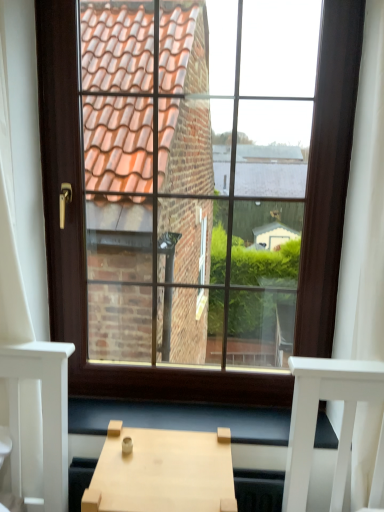
Question: From a real-world perspective, is brown wooden window at center below light wood table at center?

Choices:
 (A) yes
 (B) no

Answer: (B)

Question: Is the depth of brown wooden window at center less than that of light wood table at center?

Choices:
 (A) yes
 (B) no

Answer: (B)

Question: Is brown wooden window at center in contact with light wood table at center?

Choices:
 (A) yes
 (B) no

Answer: (B)

Question: From the image's perspective, is brown wooden window at center located above light wood table at center?

Choices:
 (A) no
 (B) yes

Answer: (B)

Question: Is brown wooden window at center thinner than light wood table at center?

Choices:
 (A) no
 (B) yes

Answer: (B)

Question: From their relative heights in the image, would you say brown wooden window at center is taller or shorter than light wood table at center?

Choices:
 (A) short
 (B) tall

Answer: (B)

Question: Considering the positions of brown wooden window at center and light wood table at center in the image, is brown wooden window at center wider or thinner than light wood table at center?

Choices:
 (A) wide
 (B) thin

Answer: (B)

Question: Is brown wooden window at center in front of or behind light wood table at center in the image?

Choices:
 (A) behind
 (B) front

Answer: (A)

Question: Does point (140, 384) appear closer or farther from the camera than point (107, 448)?

Choices:
 (A) closer
 (B) farther

Answer: (B)

Question: From a real-world perspective, is wooden at lower center positioned above or below brown wooden window at center?

Choices:
 (A) above
 (B) below

Answer: (B)

Question: Which is correct: wooden at lower center is inside brown wooden window at center, or outside of it?

Choices:
 (A) inside
 (B) outside

Answer: (B)

Question: Is wooden at lower center taller or shorter than brown wooden window at center?

Choices:
 (A) short
 (B) tall

Answer: (A)

Question: Considering the positions of wooden at lower center and brown wooden window at center in the image, is wooden at lower center wider or thinner than brown wooden window at center?

Choices:
 (A) thin
 (B) wide

Answer: (B)

Question: From a real-world perspective, is light wood table at center physically located above or below brown wooden window at center?

Choices:
 (A) below
 (B) above

Answer: (A)

Question: In terms of height, does light wood table at center look taller or shorter compared to brown wooden window at center?

Choices:
 (A) tall
 (B) short

Answer: (B)